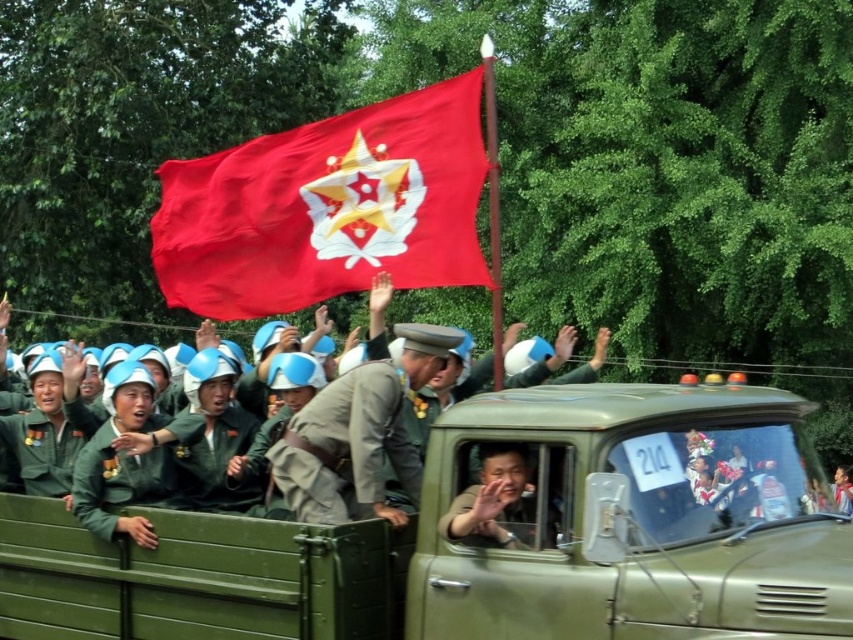
You are a photographer trying to capture a group photo of the khaki uniform at center and the matte green uniform at center. If your camera can only focus on objects within 2 inches of each other, will both uniforms be in focus?

The distance between the khaki uniform at center and matte green uniform at center is 2.46 inches, which exceeds the camera focus range of 2 inches. Therefore, both uniforms cannot be in focus simultaneously.

Consider the image. You are a photographer positioned at the front of the scene. You want to capture a photo where both the green matte truck at center and the matte green uniform at center are clearly visible. Which object should you focus on first to ensure both are in frame?

The green matte truck at center is in front of the matte green uniform at center. To ensure both are in frame, focus on the green matte truck at center first since it is closer to you, allowing the background object to remain visible.

From the picture: You are a photographer positioned to the left of the scene. You want to capture both the green matte truck at center and the matte green uniform at center in your shot. Which object should you adjust your camera to focus on first to ensure both are in frame?

Since the green matte truck at center is to the right of the matte green uniform at center, you should focus on the matte green uniform at center first as it is closer to your left position, ensuring both objects remain in frame.